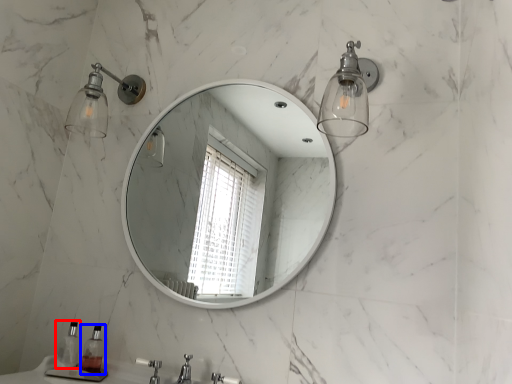
Question: Among these objects, which one is nearest to the camera, soap dispenser (highlighted by a red box) or soap dispenser (highlighted by a blue box)?

Choices:
 (A) soap dispenser
 (B) soap dispenser

Answer: (B)